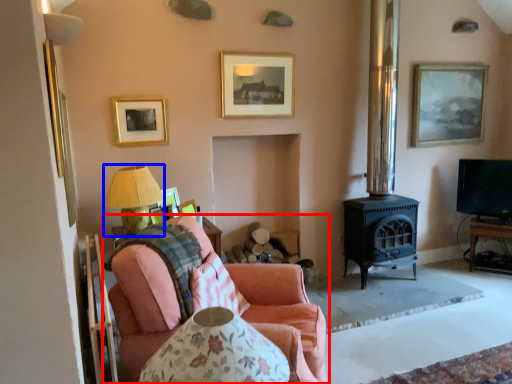
Question: Which object is further to the camera taking this photo, studio couch (highlighted by a red box) or table lamp (highlighted by a blue box)?

Choices:
 (A) studio couch
 (B) table lamp

Answer: (B)